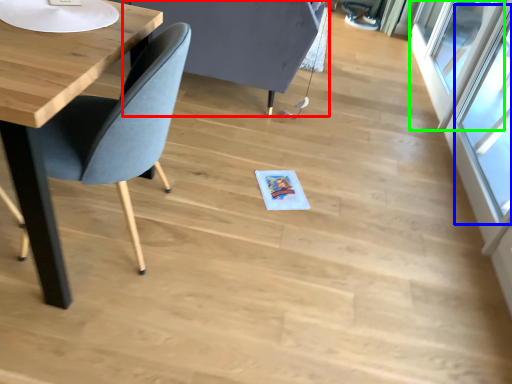
Question: Estimate the real-world distances between objects in this image. Which object is farther from swivel chair (highlighted by a red box), window (highlighted by a blue box) or window (highlighted by a green box)?

Choices:
 (A) window
 (B) window

Answer: (B)